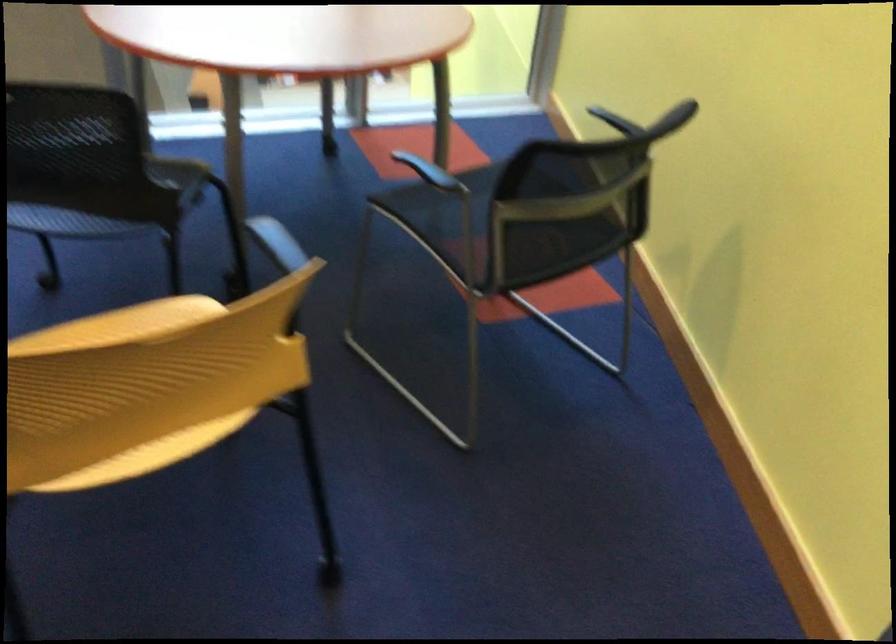
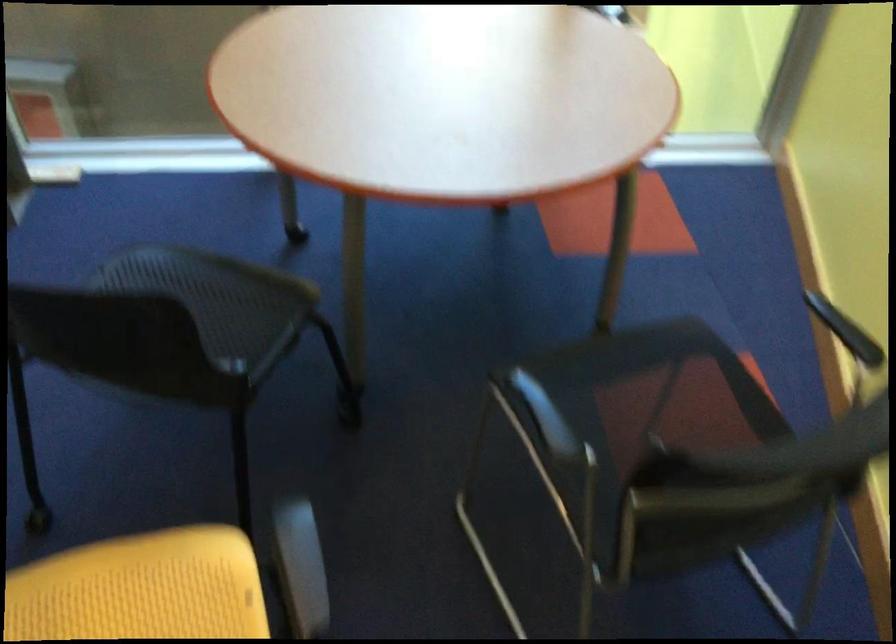
Question: The first image is from the beginning of the video and the second image is from the end. How did the camera likely rotate when shooting the video?

Choices:
 (A) Left
 (B) Right
 (C) Up
 (D) Down

Answer: (A)